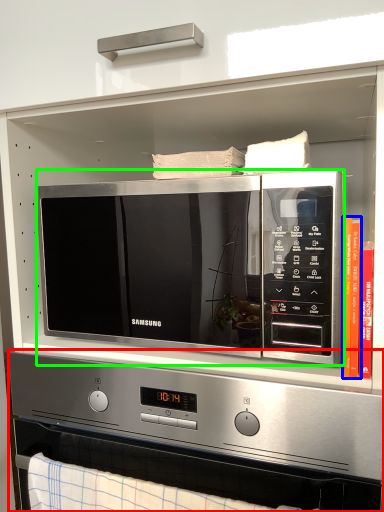
Question: Which object is positioned closest to appliance (highlighted by a red box)? Select from book (highlighted by a blue box) and microwave oven (highlighted by a green box).

Choices:
 (A) book
 (B) microwave oven

Answer: (B)